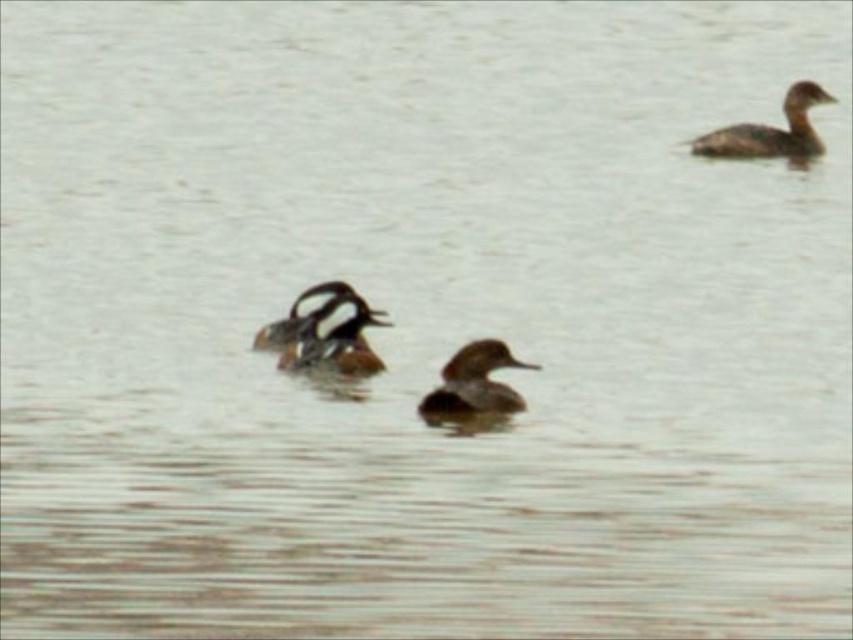
Question: Can you confirm if brown fuzzy duck at center is positioned to the left of brown matte duck at center?

Choices:
 (A) no
 (B) yes

Answer: (B)

Question: Considering the real-world distances, which object is farthest from the brown matte duck at center?

Choices:
 (A) brown fuzzy duck at center
 (B) brown speckled duck at center

Answer: (B)

Question: Based on their relative distances, which object is nearer to the brown speckled duck at upper right?

Choices:
 (A) brown speckled duck at center
 (B) brown fuzzy duck at center

Answer: (B)

Question: Which is farther from the brown matte duck at center?

Choices:
 (A) brown fuzzy duck at center
 (B) brown speckled duck at center
 (C) brown speckled duck at upper right

Answer: (C)

Question: Is brown matte duck at center below brown speckled duck at upper right?

Choices:
 (A) yes
 (B) no

Answer: (A)

Question: Is brown fuzzy duck at center thinner than brown speckled duck at upper right?

Choices:
 (A) yes
 (B) no

Answer: (A)